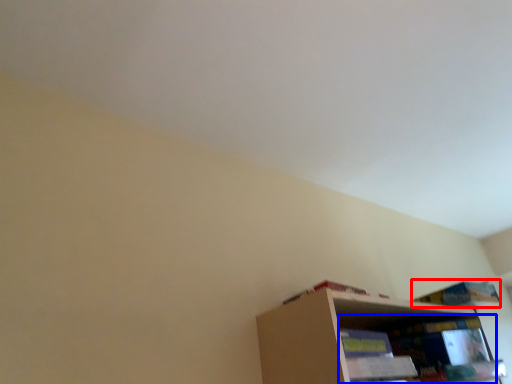
Question: Among these objects, which one is nearest to the camera, book (highlighted by a red box) or shelf (highlighted by a blue box)?

Choices:
 (A) book
 (B) shelf

Answer: (B)